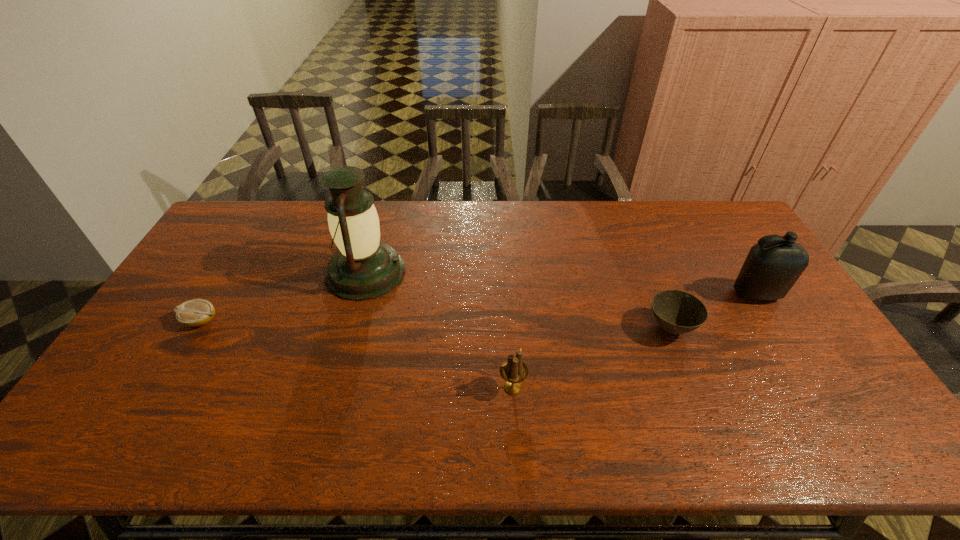
The height and width of the screenshot is (540, 960). I want to click on lantern, so click(364, 268).

The width and height of the screenshot is (960, 540). In order to click on the fourth object from right to left in this screenshot , I will do `click(364, 268)`.

Image resolution: width=960 pixels, height=540 pixels. Find the location of `the second tallest object`. the second tallest object is located at coordinates (771, 268).

Locate an element on the screen. the rightmost object is located at coordinates (771, 268).

The width and height of the screenshot is (960, 540). Identify the location of the nearest object. (514, 370).

Find the location of `the third object from left to right`. the third object from left to right is located at coordinates (514, 370).

Where is `the fourth object from left to right`? This screenshot has width=960, height=540. the fourth object from left to right is located at coordinates (677, 312).

The height and width of the screenshot is (540, 960). What are the coordinates of `the fourth tallest object` in the screenshot? It's located at (677, 312).

At what (x,y) coordinates should I click in order to perform the action: click on the shortest object. Please return your answer as a coordinate pair (x, y). Looking at the image, I should click on (196, 312).

Where is `the leftmost object`? The height and width of the screenshot is (540, 960). the leftmost object is located at coordinates (196, 312).